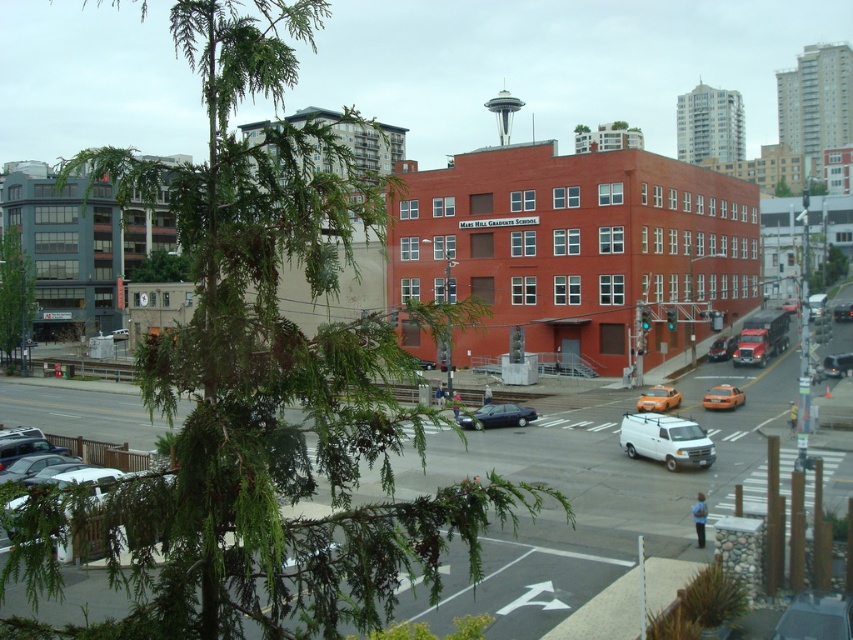
Question: Observing the image, what is the correct spatial positioning of orange matte taxi at center in reference to orange matte taxi at lower right?

Choices:
 (A) below
 (B) above

Answer: (A)

Question: Which object is the farthest from the metallic silver car at center?

Choices:
 (A) white matte van at center
 (B) green leafy tree at upper left

Answer: (B)

Question: Which point appears closest to the camera in this image?

Choices:
 (A) (850, 317)
 (B) (294, 326)
 (C) (172, 257)
 (D) (718, 404)

Answer: (B)

Question: Can you confirm if shiny black sedan at center is positioned below metallic silver sedan at center-right?

Choices:
 (A) no
 (B) yes

Answer: (B)

Question: Which of the following is the farthest from the observer?

Choices:
 (A) matte orange car at center
 (B) metallic silver sedan at center-right
 (C) shiny black sedan at center

Answer: (A)

Question: Can you confirm if satin black sedan at center is bigger than metallic silver car at center?

Choices:
 (A) no
 (B) yes

Answer: (B)